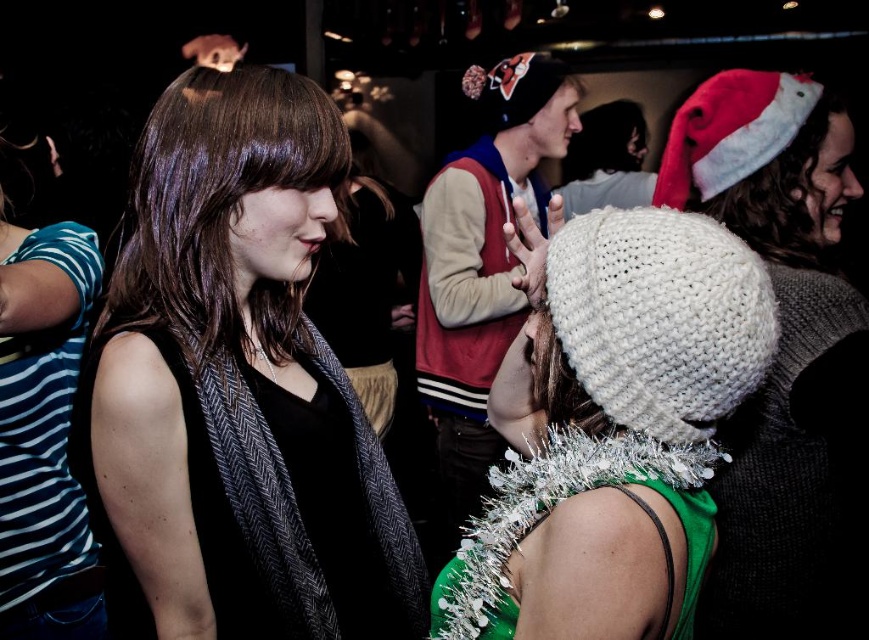
Does point (370, 492) lie in front of point (479, 632)?

No, it is behind (479, 632).

What do you see at coordinates (240, 385) in the screenshot? I see `matte black scarf at left` at bounding box center [240, 385].

The width and height of the screenshot is (869, 640). I want to click on matte black scarf at left, so click(x=240, y=385).

Between white knitted beanie at center and shiny brown hair at center, which one has less height?

With less height is shiny brown hair at center.

Is white knitted beanie at center bigger than shiny brown hair at center?

Yes.

Who is more distant from viewer, (627, 544) or (293, 96)?

The point (293, 96) is more distant.

The image size is (869, 640). What are the coordinates of `white knitted beanie at center` in the screenshot? It's located at (612, 433).

Between matte black scarf at left and shiny brown hair at center, which one has more height?

matte black scarf at left is taller.

Is matte black scarf at left to the right of shiny brown hair at center from the viewer's perspective?

Indeed, matte black scarf at left is positioned on the right side of shiny brown hair at center.

Where is `matte black scarf at left`? The width and height of the screenshot is (869, 640). matte black scarf at left is located at coordinates (240, 385).

At what (x,y) coordinates should I click in order to perform the action: click on matte black scarf at left. Please return your answer as a coordinate pair (x, y). The height and width of the screenshot is (640, 869). Looking at the image, I should click on (240, 385).